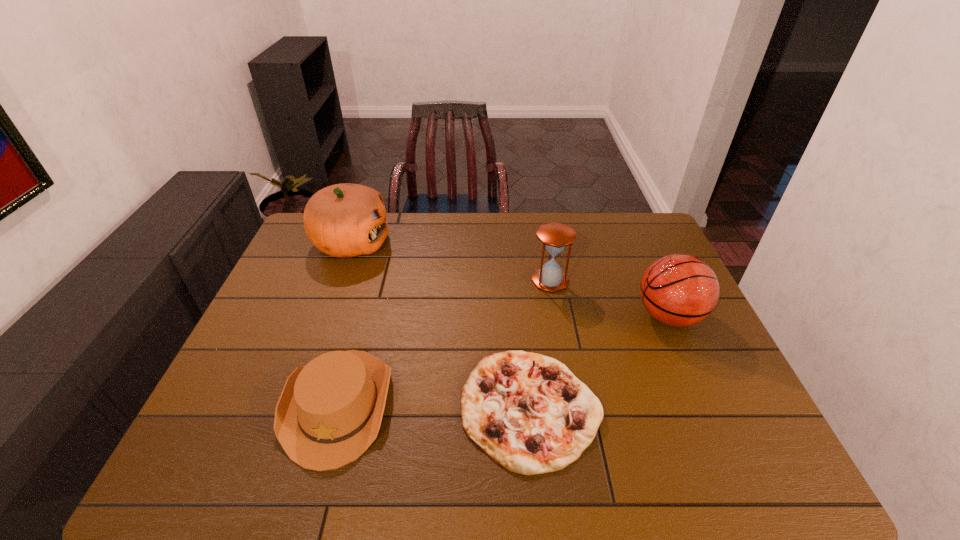
You are a GUI agent. You are given a task and a screenshot of the screen. Output one action in this format:
    pyautogui.click(x=<x>, y=<y>)
    Task: Click on the empty space that is in between the second shortest object and the farthest object
    
    Given the screenshot: What is the action you would take?
    pyautogui.click(x=345, y=323)

Locate an element on the screen. This screenshot has height=540, width=960. object identified as the closest to the hourglass is located at coordinates (680, 290).

Image resolution: width=960 pixels, height=540 pixels. What are the coordinates of `object that can be found as the third closest to the rightmost object` in the screenshot? It's located at 329,412.

Identify the location of vacant space that satisfies the following two spatial constraints: 1. on the front-facing side of the pizza; 2. on the left side of the cowboy hat. Image resolution: width=960 pixels, height=540 pixels. (338, 407).

Where is `vacant space that satisfies the following two spatial constraints: 1. on the face of the shortest object; 2. on the left side of the farthest object`? This screenshot has width=960, height=540. vacant space that satisfies the following two spatial constraints: 1. on the face of the shortest object; 2. on the left side of the farthest object is located at coordinates (291, 407).

Where is `vacant space that satisfies the following two spatial constraints: 1. on the face of the farthest object; 2. on the back side of the hourglass`? vacant space that satisfies the following two spatial constraints: 1. on the face of the farthest object; 2. on the back side of the hourglass is located at coordinates (338, 280).

Find the location of a particular element. free point that satisfies the following two spatial constraints: 1. on the back side of the hourglass; 2. on the face of the pumpkin is located at coordinates (543, 243).

Where is `free spot that satisfies the following two spatial constraints: 1. on the side with spill of the rightmost object; 2. on the front-facing side of the cowboy hat`? free spot that satisfies the following two spatial constraints: 1. on the side with spill of the rightmost object; 2. on the front-facing side of the cowboy hat is located at coordinates (708, 404).

This screenshot has width=960, height=540. I want to click on vacant area in the image that satisfies the following two spatial constraints: 1. on the face of the farthest object; 2. on the right side of the hourglass, so click(338, 280).

Identify the location of blank space that satisfies the following two spatial constraints: 1. on the face of the farthest object; 2. on the right side of the pizza. Image resolution: width=960 pixels, height=540 pixels. (291, 407).